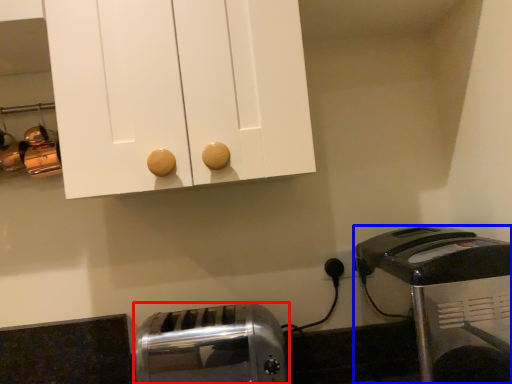
Question: Which object is closer to the camera taking this photo, toaster (highlighted by a red box) or toaster (highlighted by a blue box)?

Choices:
 (A) toaster
 (B) toaster

Answer: (B)